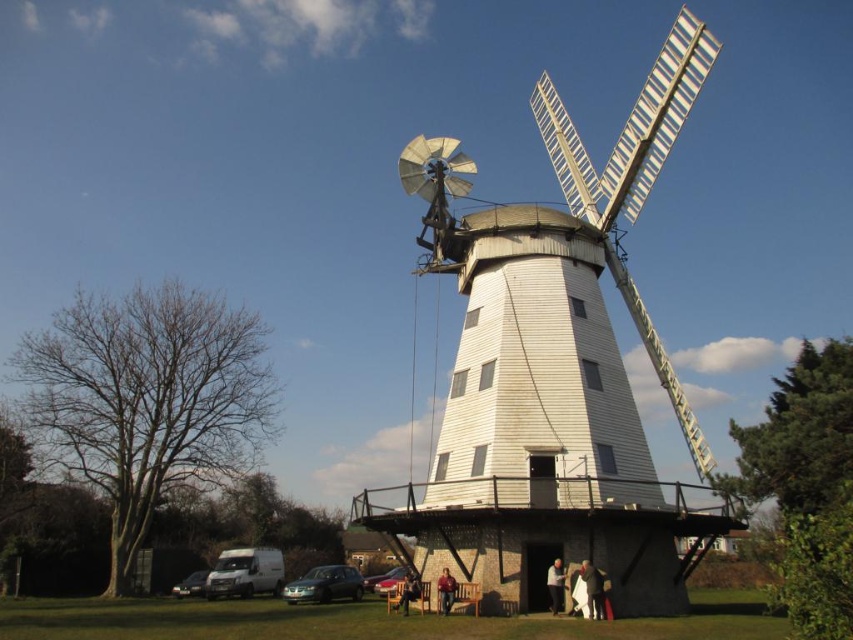
Question: Estimate the real-world distances between objects in this image. Which object is closer to the white matte van at lower left?

Choices:
 (A) light brown wooden chair at lower center
 (B) dark brown leather chair at lower center
 (C) metallic silver car at center

Answer: (C)

Question: Is white wooden windmill at center above metallic silver car at center?

Choices:
 (A) yes
 (B) no

Answer: (A)

Question: Can you confirm if white matte van at lower left is positioned above metallic silver car at lower left?

Choices:
 (A) no
 (B) yes

Answer: (B)

Question: Is light brown wooden chair at lower center smaller than brown leather jacket at lower center?

Choices:
 (A) yes
 (B) no

Answer: (B)

Question: Among these objects, which one is nearest to the camera?

Choices:
 (A) brown leather jacket at lower center
 (B) dark gray fabric coat at lower center
 (C) dark brown leather chair at lower center
 (D) light brown wooden chair at lower center

Answer: (B)

Question: Which point is farther from the camera taking this photo?

Choices:
 (A) (555, 580)
 (B) (405, 584)
 (C) (383, 593)

Answer: (C)